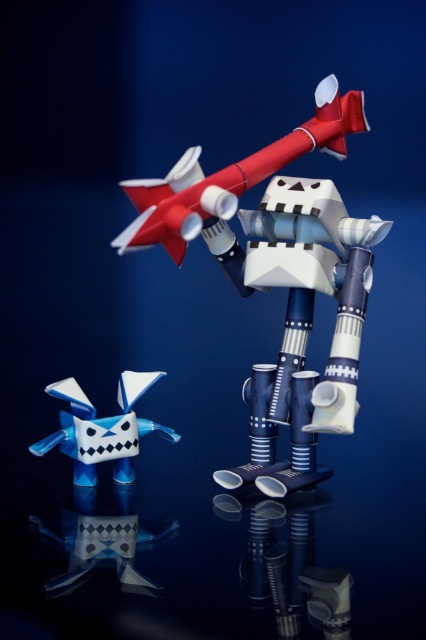
Does point (146, 189) lie in front of point (42, 451)?

Yes.

Does matte plastic rocket at center have a lesser width compared to translucent blue plastic toy at lower left?

No, matte plastic rocket at center is not thinner than translucent blue plastic toy at lower left.

I want to click on matte plastic rocket at center, so click(x=232, y=177).

Can you confirm if matte plastic robot at center is bigger than matte plastic rocket at center?

Indeed, matte plastic robot at center has a larger size compared to matte plastic rocket at center.

Is point (196, 147) positioned before point (186, 179)?

That is False.

This screenshot has width=426, height=640. Describe the element at coordinates (278, 266) in the screenshot. I see `matte plastic robot at center` at that location.

Find the location of a particular element. The height and width of the screenshot is (640, 426). matte plastic robot at center is located at coordinates (278, 266).

Who is positioned more to the left, matte plastic robot at center or translucent blue plastic toy at lower left?

translucent blue plastic toy at lower left is more to the left.

Can you confirm if matte plastic robot at center is shorter than translucent blue plastic toy at lower left?

In fact, matte plastic robot at center may be taller than translucent blue plastic toy at lower left.

Locate an element on the screen. The height and width of the screenshot is (640, 426). matte plastic robot at center is located at coordinates (278, 266).